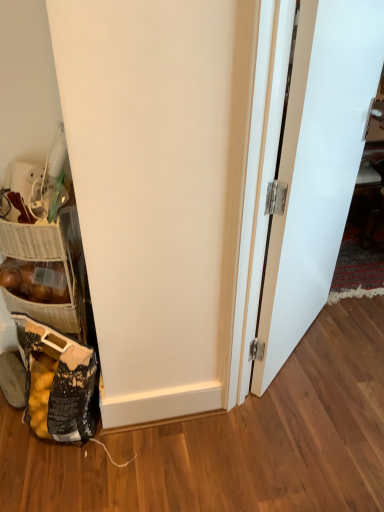
Where is `free spot to the right of white matte door at right`? This screenshot has height=512, width=384. free spot to the right of white matte door at right is located at coordinates (348, 334).